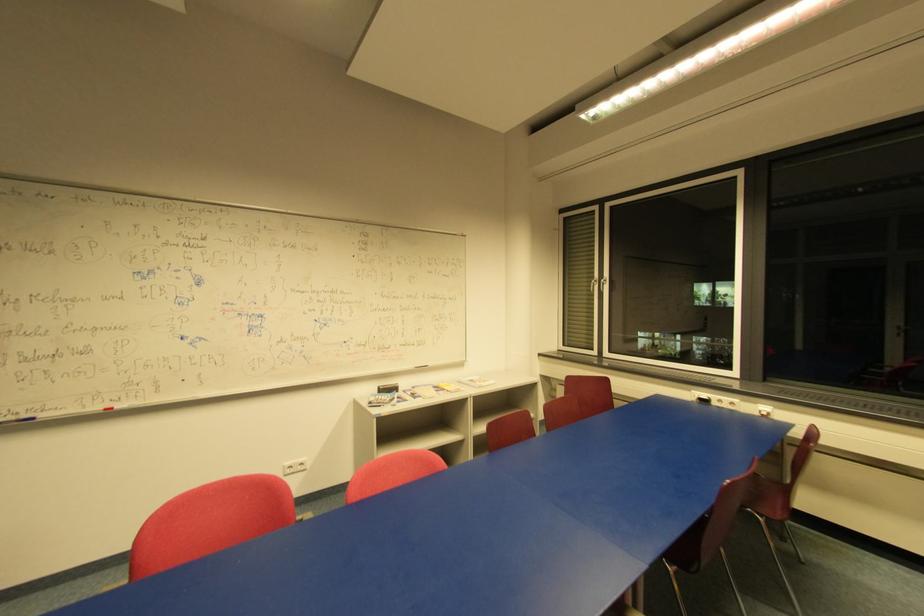
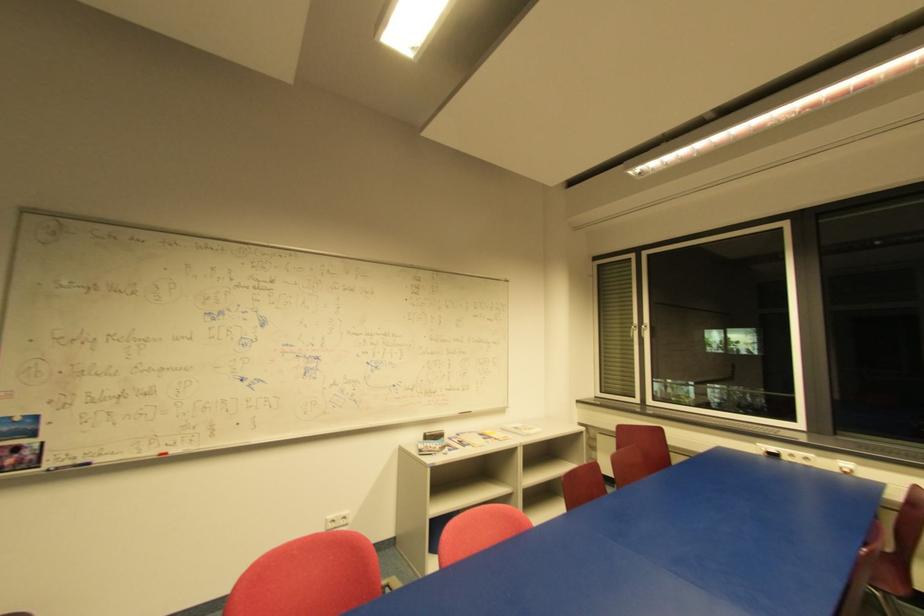
Question: The first image is from the beginning of the video and the second image is from the end. How did the camera likely rotate when shooting the video?

Choices:
 (A) Left
 (B) Right
 (C) Up
 (D) Down

Answer: (C)